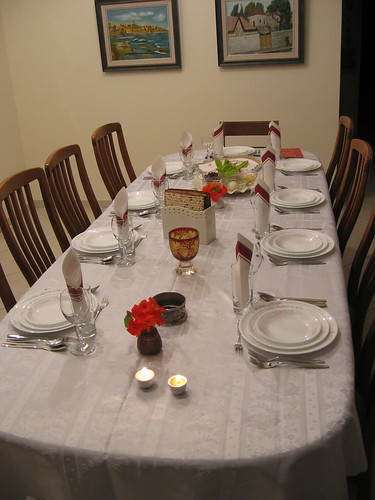
Identify the location of seats. (9, 291), (32, 276), (66, 217), (99, 134), (344, 122), (361, 146), (358, 253), (366, 409), (251, 127).